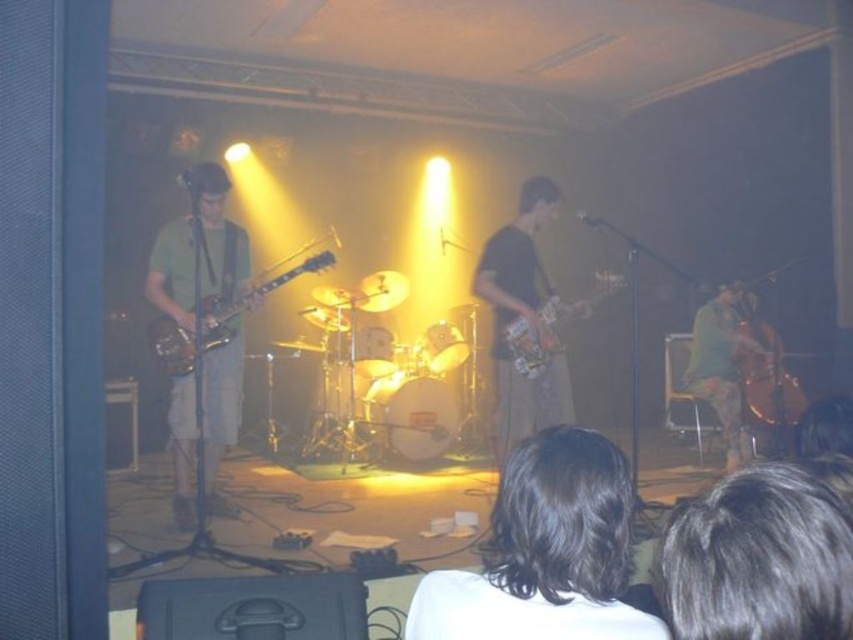
Question: Which point appears closest to the camera in this image?

Choices:
 (A) (242, 304)
 (B) (585, 304)

Answer: (A)

Question: Is dark brown hair at lower right to the right of green matte cello at right from the viewer's perspective?

Choices:
 (A) no
 (B) yes

Answer: (A)

Question: Among these objects, which one is nearest to the camera?

Choices:
 (A) gold metallic cello at right
 (B) dark brown leather guitar at center
 (C) glossy electric guitar at center
 (D) glossy wood guitar at left

Answer: (D)

Question: Is the position of green matte cello at right less distant than that of gold metallic cello at right?

Choices:
 (A) no
 (B) yes

Answer: (B)

Question: Observing the image, what is the correct spatial positioning of dark brown leather guitar at center in reference to green matte cello at right?

Choices:
 (A) left
 (B) right

Answer: (A)

Question: Considering the real-world distances, which object is closest to the dark brown hair at lower center?

Choices:
 (A) green matte cello at right
 (B) glossy electric guitar at center
 (C) dark brown leather guitar at center

Answer: (C)